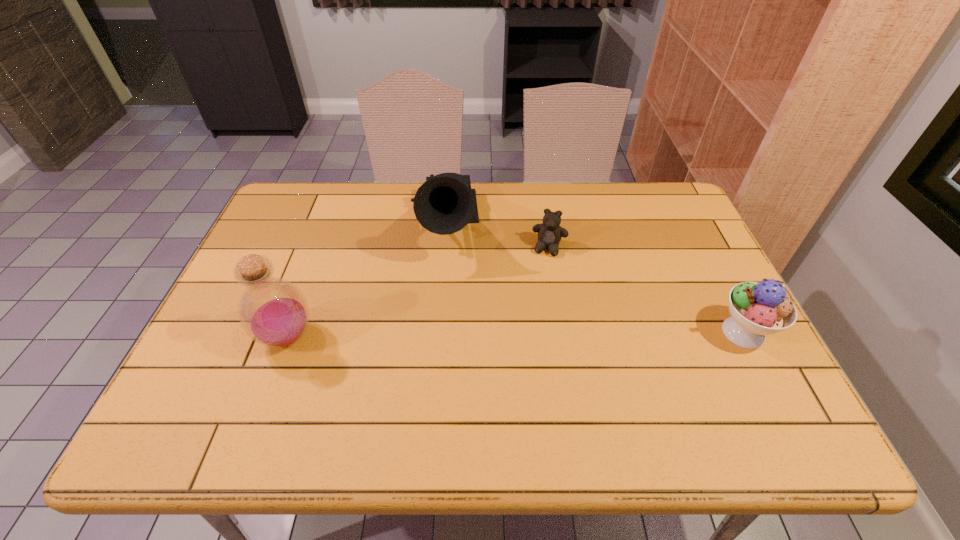
This screenshot has height=540, width=960. What are the coordinates of `blank space located on the face of the second object from right to left` in the screenshot? It's located at (522, 360).

At what (x,y) coordinates should I click in order to perform the action: click on vacant space positioned 0.380m from the horn of the phonograph_record. Please return your answer as a coordinate pair (x, y). Looking at the image, I should click on (447, 392).

You are a GUI agent. You are given a task and a screenshot of the screen. Output one action in this format:
    pyautogui.click(x=<x>, y=<y>)
    Task: Click on the blank area located from the horn of the phonograph_record
    The width and height of the screenshot is (960, 540).
    Given the screenshot: What is the action you would take?
    pyautogui.click(x=445, y=318)

What are the coordinates of `vacant space located 0.120m from the horn of the phonograph_record` in the screenshot? It's located at (444, 303).

The height and width of the screenshot is (540, 960). I want to click on object present at the far edge, so click(444, 204).

Find the location of a particular element. object positioned at the left edge is located at coordinates (274, 312).

At what (x,y) coordinates should I click in order to perform the action: click on object located in the right edge section of the desktop. Please return your answer as a coordinate pair (x, y). The width and height of the screenshot is (960, 540). Looking at the image, I should click on (758, 309).

Find the location of `free space at the far edge of the desktop`. free space at the far edge of the desktop is located at coordinates (350, 182).

You are a GUI agent. You are given a task and a screenshot of the screen. Output one action in this format:
    pyautogui.click(x=<x>, y=<y>)
    Task: Click on the vacant space at the near edge of the desktop
    
    Given the screenshot: What is the action you would take?
    pyautogui.click(x=432, y=394)

In the image, there is a desktop. At what (x,y) coordinates should I click in order to perform the action: click on vacant area at the left edge. Please return your answer as a coordinate pair (x, y). The height and width of the screenshot is (540, 960). Looking at the image, I should click on (256, 348).